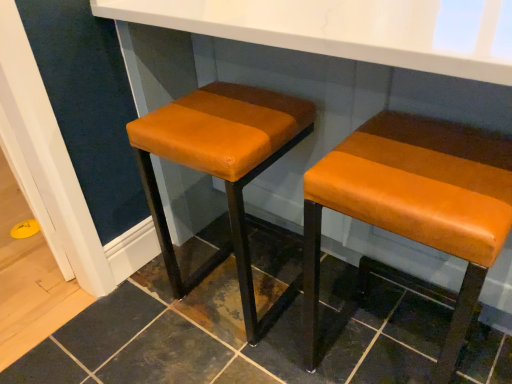
Where is `orange leather stool at center, which appears as the first stool when viewed from the left`? orange leather stool at center, which appears as the first stool when viewed from the left is located at coordinates (222, 169).

The height and width of the screenshot is (384, 512). Describe the element at coordinates (222, 169) in the screenshot. I see `orange leather stool at center, the 2th stool from the right` at that location.

In order to face orange leather stool at right, the 2th stool from the left, should I rotate leftwards or rightwards?

Rotate your view right by about 19.326°.

This screenshot has height=384, width=512. Describe the element at coordinates (415, 205) in the screenshot. I see `orange leather stool at right, the 1th stool in the right-to-left sequence` at that location.

You are a GUI agent. You are given a task and a screenshot of the screen. Output one action in this format:
    pyautogui.click(x=<x>, y=<y>)
    Task: Click on the orange leather stool at right, the 1th stool in the right-to-left sequence
    The width and height of the screenshot is (512, 384).
    Given the screenshot: What is the action you would take?
    pyautogui.click(x=415, y=205)

I want to click on orange leather stool at center, the 2th stool from the right, so click(x=222, y=169).

Considering the relative positions of orange leather stool at right, the 2th stool from the left, and orange leather stool at center, the 2th stool from the right, in the image provided, is orange leather stool at right, the 2th stool from the left, to the left or to the right of orange leather stool at center, the 2th stool from the right,?

Clearly, orange leather stool at right, the 2th stool from the left, is on the right of orange leather stool at center, the 2th stool from the right, in the image.

Is the depth of orange leather stool at right, the 2th stool from the left, greater than that of orange leather stool at center, which appears as the first stool when viewed from the left?

No, the depth of orange leather stool at right, the 2th stool from the left, is less than that of orange leather stool at center, which appears as the first stool when viewed from the left.

Is point (381, 228) positioned before point (262, 118)?

No.

From the image's perspective, which one is positioned higher, orange leather stool at right, the 2th stool from the left, or orange leather stool at center, the 2th stool from the right?

orange leather stool at center, the 2th stool from the right, is shown above in the image.

From a real-world perspective, is orange leather stool at right, the 2th stool from the left, over orange leather stool at center, which appears as the first stool when viewed from the left?

Indeed, from a real-world perspective, orange leather stool at right, the 2th stool from the left, stands above orange leather stool at center, which appears as the first stool when viewed from the left.

Considering the sizes of orange leather stool at right, the 1th stool in the right-to-left sequence, and orange leather stool at center, the 2th stool from the right, in the image, is orange leather stool at right, the 1th stool in the right-to-left sequence, wider or thinner than orange leather stool at center, the 2th stool from the right,?

Considering their sizes, orange leather stool at right, the 1th stool in the right-to-left sequence, looks broader than orange leather stool at center, the 2th stool from the right.

In terms of height, does orange leather stool at right, the 2th stool from the left, look taller or shorter compared to orange leather stool at center, which appears as the first stool when viewed from the left?

orange leather stool at right, the 2th stool from the left, is shorter than orange leather stool at center, which appears as the first stool when viewed from the left.

From the picture: Does orange leather stool at right, the 2th stool from the left, have a larger size compared to orange leather stool at center, which appears as the first stool when viewed from the left?

No.

Which is correct: orange leather stool at right, the 2th stool from the left, is inside orange leather stool at center, which appears as the first stool when viewed from the left, or outside of it?

orange leather stool at right, the 2th stool from the left, exists outside the volume of orange leather stool at center, which appears as the first stool when viewed from the left.

In the scene shown: Is orange leather stool at right, the 1th stool in the right-to-left sequence, far away from orange leather stool at center, the 2th stool from the right?

They are positioned close to each other.

Does orange leather stool at right, the 2th stool from the left, turn towards orange leather stool at center, the 2th stool from the right?

No, orange leather stool at right, the 2th stool from the left, is not turned towards orange leather stool at center, the 2th stool from the right.

Identify the location of stool above the orange leather stool at center, which appears as the first stool when viewed from the left (from a real-world perspective). The width and height of the screenshot is (512, 384). pyautogui.click(x=415, y=205).

Is orange leather stool at center, which appears as the first stool when viewed from the left, at the left side of orange leather stool at right, the 2th stool from the left?

Yes.

Which object is closer to the camera, orange leather stool at center, which appears as the first stool when viewed from the left, or orange leather stool at right, the 2th stool from the left?

Positioned in front is orange leather stool at right, the 2th stool from the left.

Does point (207, 160) lie in front of point (469, 255)?

That is False.

From the image's perspective, is orange leather stool at center, the 2th stool from the right, located above or below orange leather stool at right, the 1th stool in the right-to-left sequence?

orange leather stool at center, the 2th stool from the right, is above orange leather stool at right, the 1th stool in the right-to-left sequence.

From a real-world perspective, between orange leather stool at center, the 2th stool from the right, and orange leather stool at right, the 2th stool from the left, who is vertically lower?

In real-world perspective, orange leather stool at center, the 2th stool from the right, is lower.

Between orange leather stool at center, which appears as the first stool when viewed from the left, and orange leather stool at right, the 1th stool in the right-to-left sequence, which one has smaller width?

With smaller width is orange leather stool at center, which appears as the first stool when viewed from the left.

Which of these two, orange leather stool at center, the 2th stool from the right, or orange leather stool at right, the 2th stool from the left, stands taller?

orange leather stool at center, the 2th stool from the right, is taller.

Which of these two, orange leather stool at center, which appears as the first stool when viewed from the left, or orange leather stool at right, the 2th stool from the left, is smaller?

orange leather stool at right, the 2th stool from the left.

Would you say orange leather stool at center, the 2th stool from the right, is inside or outside orange leather stool at right, the 1th stool in the right-to-left sequence?

orange leather stool at center, the 2th stool from the right, is located beyond the bounds of orange leather stool at right, the 1th stool in the right-to-left sequence.

Is orange leather stool at center, which appears as the first stool when viewed from the left, with orange leather stool at right, the 1th stool in the right-to-left sequence?

orange leather stool at center, which appears as the first stool when viewed from the left, is not next to orange leather stool at right, the 1th stool in the right-to-left sequence, and they're not touching.

Is orange leather stool at center, which appears as the first stool when viewed from the left, facing towards orange leather stool at right, the 1th stool in the right-to-left sequence?

No, orange leather stool at center, which appears as the first stool when viewed from the left, does not turn towards orange leather stool at right, the 1th stool in the right-to-left sequence.

Can you tell me how much orange leather stool at center, the 2th stool from the right, and orange leather stool at right, the 1th stool in the right-to-left sequence, differ in facing direction?

The angle between the facing direction of orange leather stool at center, the 2th stool from the right, and the facing direction of orange leather stool at right, the 1th stool in the right-to-left sequence, is 2.26 degrees.

Where is `stool lying in front of the orange leather stool at center, the 2th stool from the right`? This screenshot has height=384, width=512. stool lying in front of the orange leather stool at center, the 2th stool from the right is located at coordinates (415, 205).

Image resolution: width=512 pixels, height=384 pixels. There is a orange leather stool at center, the 2th stool from the right. What are the coordinates of `stool above it (from a real-world perspective)` in the screenshot? It's located at (415, 205).

Image resolution: width=512 pixels, height=384 pixels. What are the coordinates of `stool in front of the orange leather stool at center, the 2th stool from the right` in the screenshot? It's located at (415, 205).